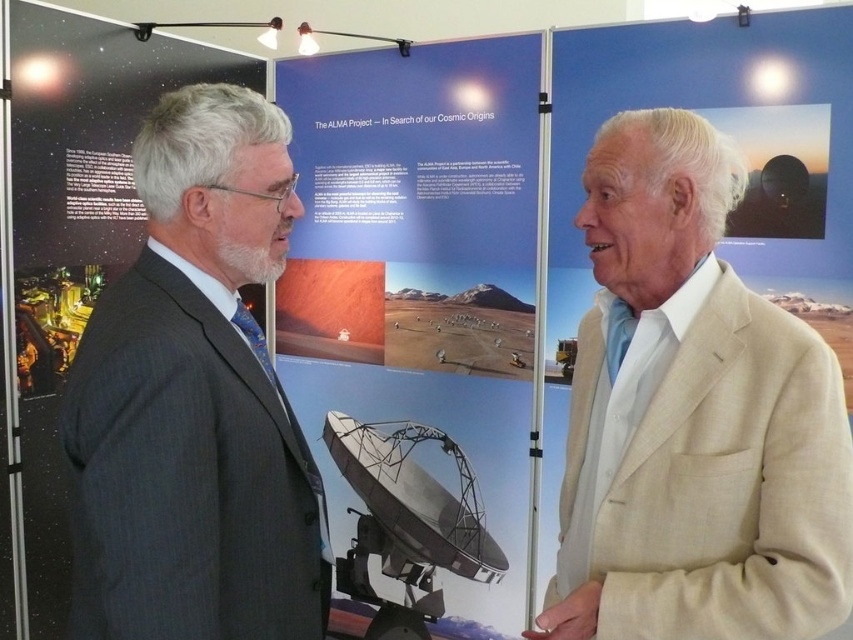
You are attending an event and need to approach the two people wearing suits. The beige linen suit at right and the dark gray suit at left are part of the exhibit on cosmic origins. Which person should you approach first if you want to speak to the one closer to the exhibit panels?

The dark gray suit at left is closer to the exhibit panels because the beige linen suit at right is positioned under it, indicating it is further away.

From the picture: You are a photographer at the event and want to capture both the dark gray suit at left and the matte black satellite dish at center in a single frame. Given that your camera has a fixed focal length, which object should you position closer to the center of the frame to ensure both are fully visible?

Since the dark gray suit at left is narrower than the matte black satellite dish at center, you should position the dark gray suit at left closer to the center of the frame. This allows the wider matte black satellite dish at center to fit within the frame while keeping both subjects visible.

You are standing at the center of the exhibition hall and see a point marked at coordinates (195, 400). Which object does this point belong to?

The point at coordinates (195, 400) is on the dark gray suit at left.